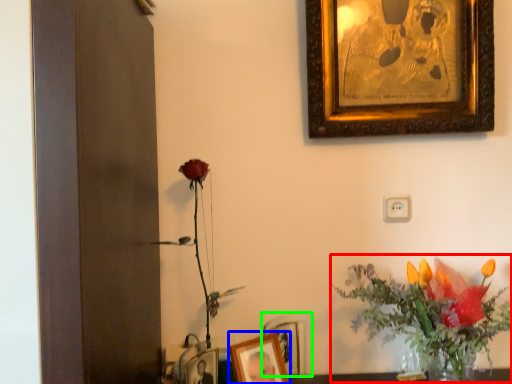
Question: Estimate the real-world distances between objects in this image. Which object is closer to floral arrangement (highlighted by a red box), picture frame (highlighted by a blue box) or picture frame (highlighted by a green box)?

Choices:
 (A) picture frame
 (B) picture frame

Answer: (B)